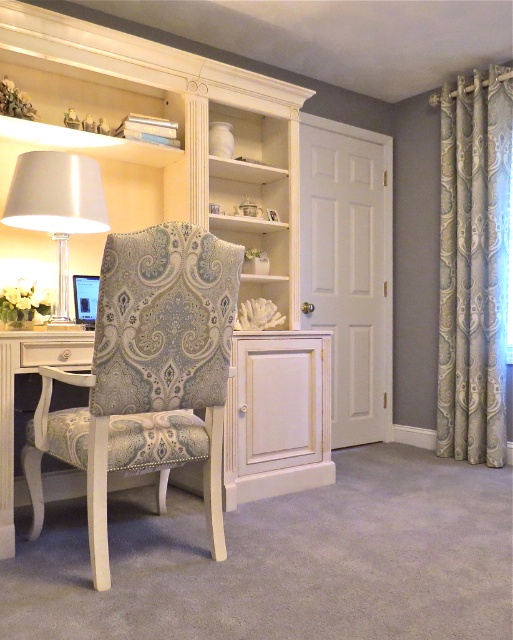
Question: Which of the following is the closest to the observer?

Choices:
 (A) matte white desk at center
 (B) satin silver lampshade at left

Answer: (B)

Question: Can you confirm if silky beige curtain at right is positioned to the right of matte white desk at center?

Choices:
 (A) no
 (B) yes

Answer: (B)

Question: Which point is farther from the camera taking this photo?

Choices:
 (A) (277, 333)
 (B) (469, 225)
 (C) (187, 285)

Answer: (B)

Question: Does patterned fabric swivel chair at left have a lesser width compared to matte white desk at center?

Choices:
 (A) yes
 (B) no

Answer: (A)

Question: Is silky beige curtain at right positioned at the back of satin silver lampshade at left?

Choices:
 (A) yes
 (B) no

Answer: (A)

Question: Which point appears farthest from the camera in this image?

Choices:
 (A) (490, 168)
 (B) (245, 422)
 (C) (62, 211)
 (D) (84, 408)

Answer: (A)